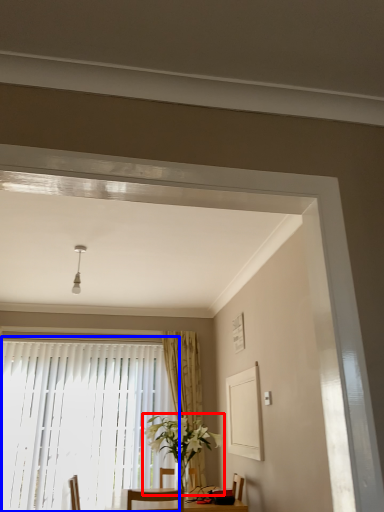
Question: Which point is further to the camera, houseplant (highlighted by a red box) or window (highlighted by a blue box)?

Choices:
 (A) houseplant
 (B) window

Answer: (B)